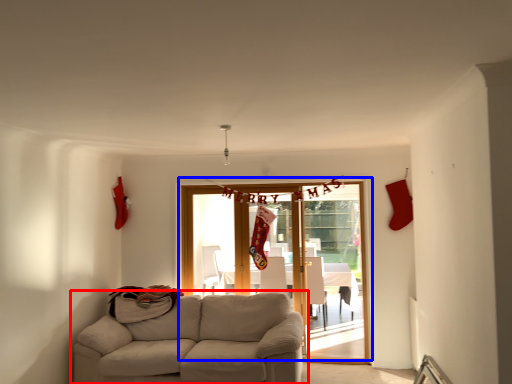
Question: Among these objects, which one is farthest to the camera, studio couch (highlighted by a red box) or door (highlighted by a blue box)?

Choices:
 (A) studio couch
 (B) door

Answer: (B)